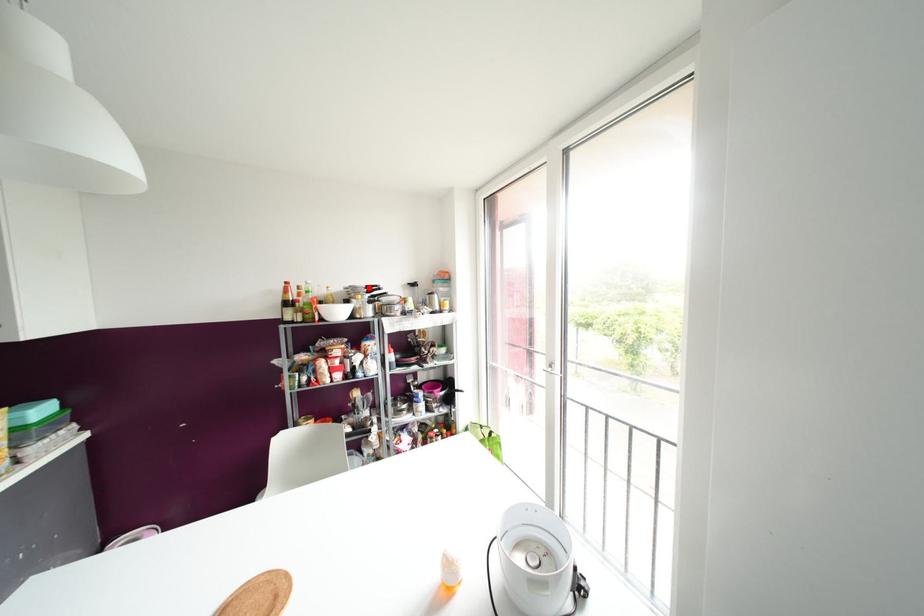
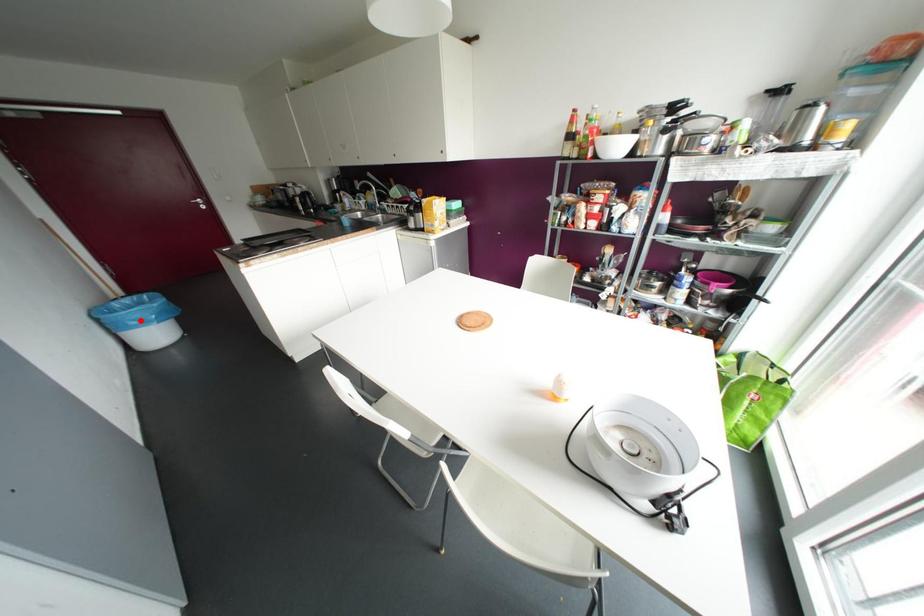
I am providing you with two images of the same scene from different viewpoints. A red point is marked on the first image and another point is marked on the second image. Is the marked point in image1 the same physical position as the marked point in image2?

No